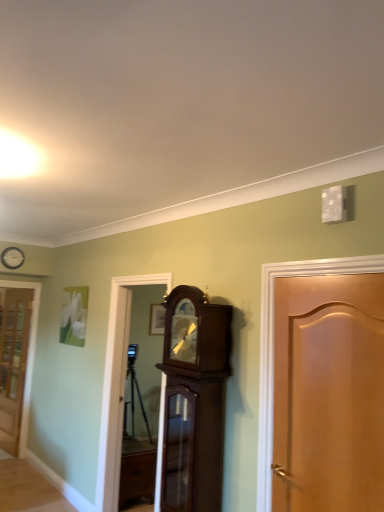
Question: From the image's perspective, does white wooden clock at upper left appear higher than mahogany wood grandfather clock at center, which ranks as the second cabinetry in bottom-to-top order?

Choices:
 (A) no
 (B) yes

Answer: (B)

Question: Is the position of white wooden clock at upper left less distant than that of mahogany wood grandfather clock at center, the 2th cabinetry in the back-to-front sequence?

Choices:
 (A) yes
 (B) no

Answer: (B)

Question: Is white wooden clock at upper left turned away from mahogany wood grandfather clock at center, the 2th cabinetry in the back-to-front sequence?

Choices:
 (A) no
 (B) yes

Answer: (A)

Question: Is white wooden clock at upper left far from mahogany wood grandfather clock at center, the first cabinetry from the front?

Choices:
 (A) no
 (B) yes

Answer: (B)

Question: Is white wooden clock at upper left to the left of mahogany wood grandfather clock at center, the first cabinetry from the front, from the viewer's perspective?

Choices:
 (A) no
 (B) yes

Answer: (B)

Question: Considering the positions of white wooden clock at upper left and wooden door at right, which ranks as the second door in back-to-front order, in the image, is white wooden clock at upper left taller or shorter than wooden door at right, which ranks as the second door in back-to-front order,?

Choices:
 (A) tall
 (B) short

Answer: (B)

Question: Looking at their shapes, would you say white wooden clock at upper left is wider or thinner than wooden door at right, the first door positioned from the front?

Choices:
 (A) thin
 (B) wide

Answer: (A)

Question: Is point (16, 265) closer or farther from the camera than point (380, 306)?

Choices:
 (A) farther
 (B) closer

Answer: (A)

Question: Is white wooden clock at upper left situated inside wooden door at right, which ranks as the second door in back-to-front order, or outside?

Choices:
 (A) inside
 (B) outside

Answer: (B)

Question: Considering their positions, is brown wooden cabinet at center, which ranks as the first cabinetry in back-to-front order, located in front of or behind wooden door at right, the 1th door from the right?

Choices:
 (A) front
 (B) behind

Answer: (B)

Question: From a real-world perspective, is brown wooden cabinet at center, the 1th cabinetry from the left, above or below wooden door at right, the first door positioned from the front?

Choices:
 (A) below
 (B) above

Answer: (A)

Question: From the image's perspective, is brown wooden cabinet at center, the 2th cabinetry when ordered from top to bottom, positioned above or below wooden door at right, the first door positioned from the front?

Choices:
 (A) below
 (B) above

Answer: (A)

Question: Do you think brown wooden cabinet at center, which appears as the 2th cabinetry when viewed from the right, is within wooden door at right, which ranks as the second door in back-to-front order, or outside of it?

Choices:
 (A) outside
 (B) inside

Answer: (A)

Question: Is wooden door at right, which ranks as the second door in back-to-front order, inside or outside of translucent glass door at left, which is the 2th door from front to back?

Choices:
 (A) inside
 (B) outside

Answer: (B)

Question: From the image's perspective, relative to translucent glass door at left, positioned as the 1th door in left-to-right order, is wooden door at right, the 2th door when ordered from left to right, above or below?

Choices:
 (A) above
 (B) below

Answer: (A)